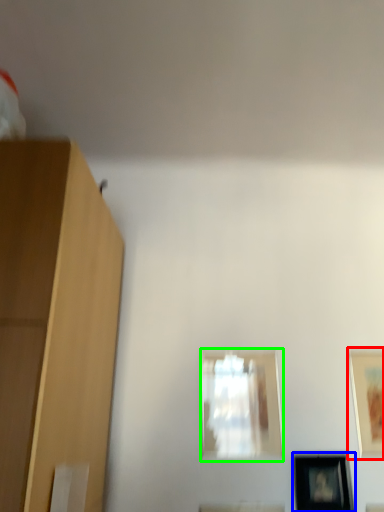
Question: Based on their relative distances, which object is farther from picture frame (highlighted by a red box)? Choose from picture frame (highlighted by a blue box) and picture frame (highlighted by a green box).

Choices:
 (A) picture frame
 (B) picture frame

Answer: (B)